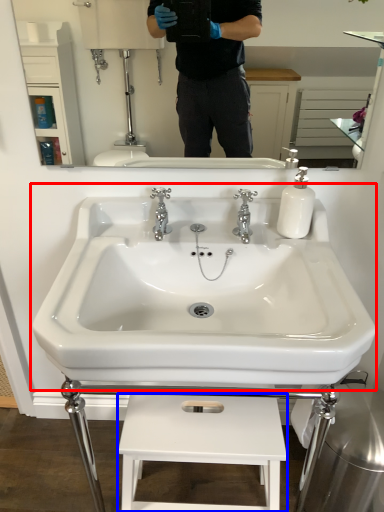
Question: Which object appears closest to the camera in this image, sink (highlighted by a red box) or lift (highlighted by a blue box)?

Choices:
 (A) sink
 (B) lift

Answer: (A)